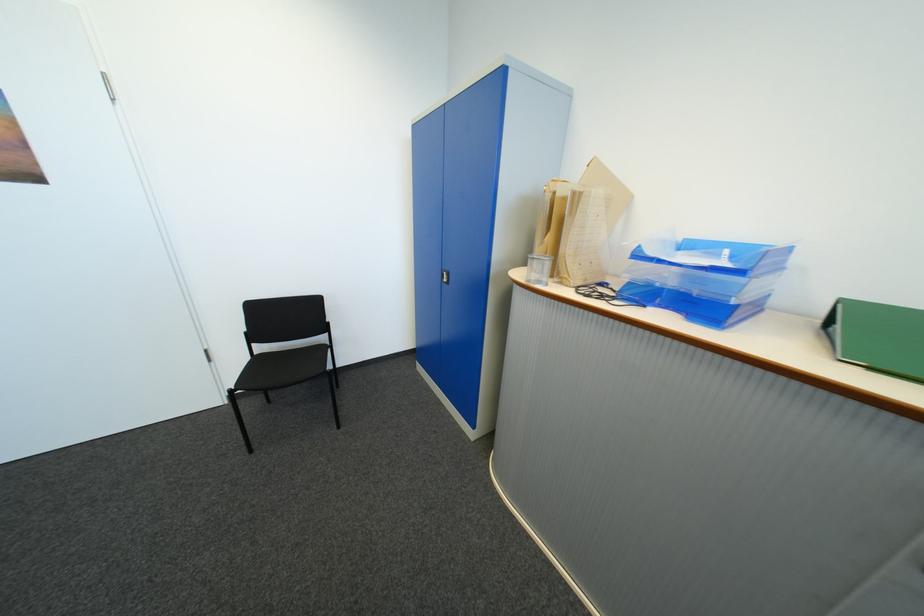
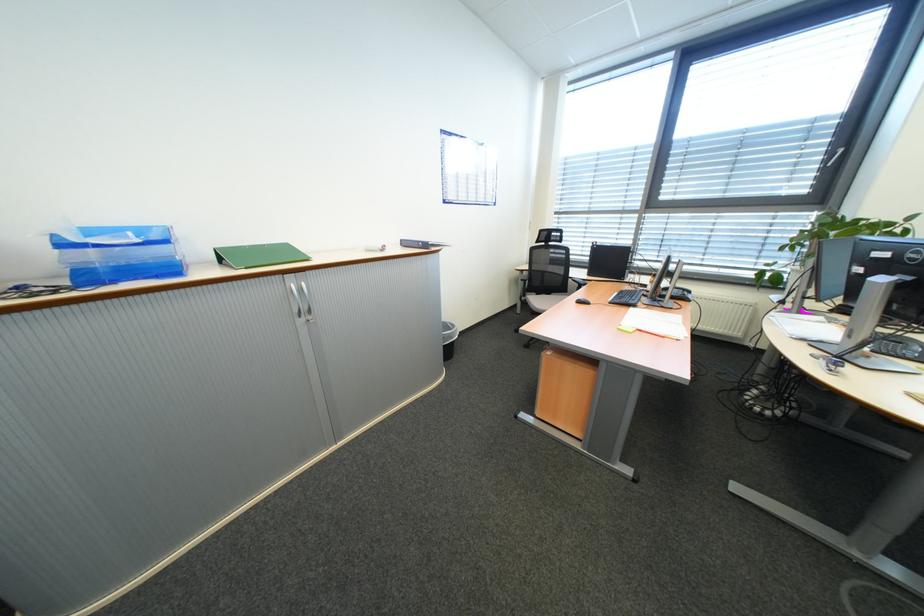
Where in the second image is the point corresponding to (671,262) from the first image?

(107, 246)